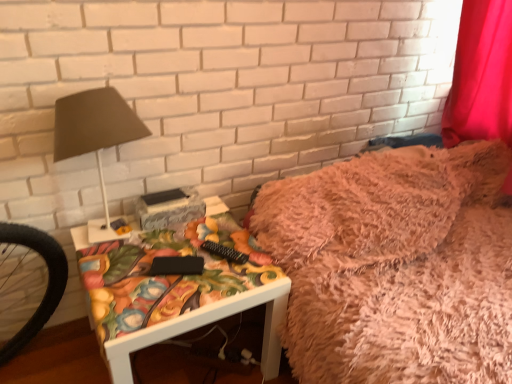
Question: Is matte brown lampshade at left bigger or smaller than matte floral-patterned side table at center?

Choices:
 (A) small
 (B) big

Answer: (A)

Question: Is matte brown lampshade at left inside or outside of matte floral-patterned side table at center?

Choices:
 (A) outside
 (B) inside

Answer: (A)

Question: Estimate the real-world distances between objects in this image. Which object is closer to the matte brown lampshade at left?

Choices:
 (A) matte floral-patterned side table at center
 (B) fuzzy pink blanket at upper right

Answer: (A)

Question: Estimate the real-world distances between objects in this image. Which object is farther from the matte brown lampshade at left?

Choices:
 (A) fuzzy pink blanket at upper right
 (B) matte floral-patterned side table at center

Answer: (A)